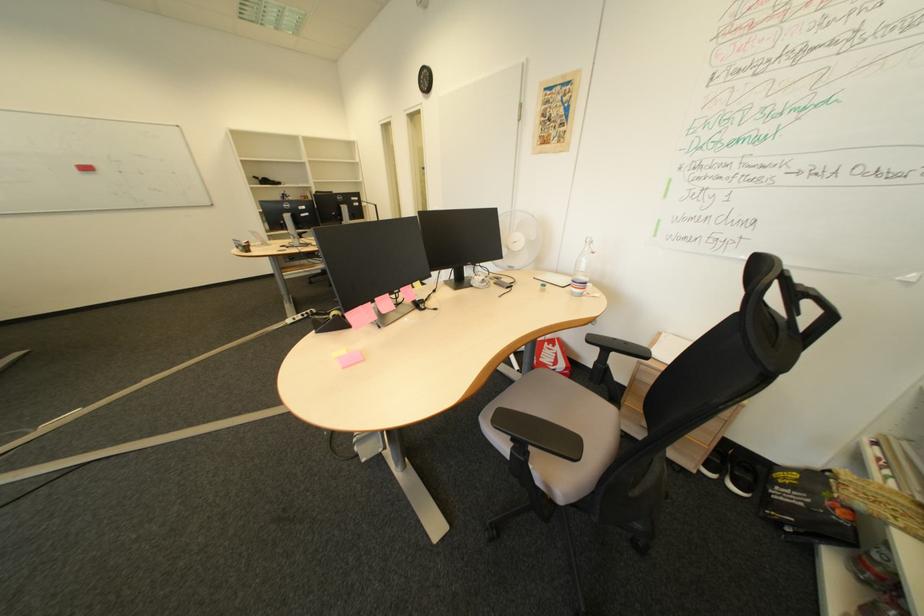
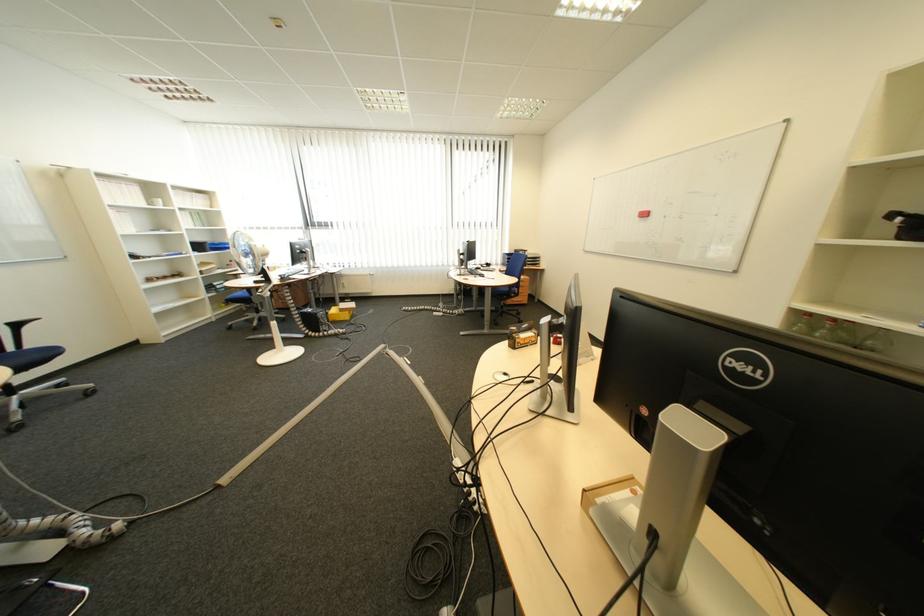
Locate, in the second image, the point that corresponds to point 135,174 in the first image.

(677, 217)